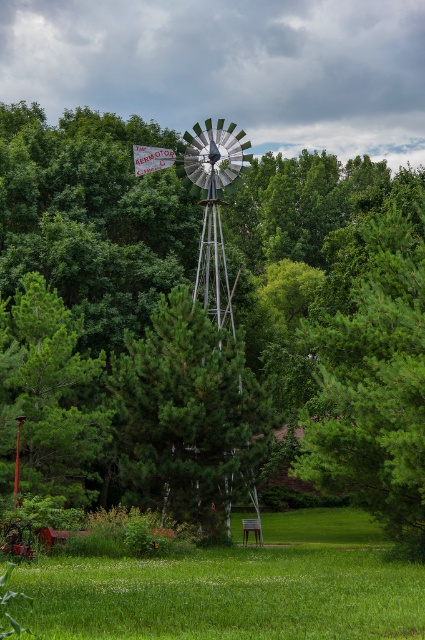
You are planning to plant a new tree in the garden. You have two options from the image, the green leafy tree at center and the green textured pine tree at center. Which one requires more space to grow properly?

The green leafy tree at center requires more space to grow properly because it is bigger than the green textured pine tree at center.

You are standing in the rural landscape and want to take a photo of both the green grass at lower center and the green matte tree at center. Which object should you focus on first to ensure both are in clear view?

You should focus on the green grass at lower center first because it is closer to the viewer than the green matte tree at center, so adjusting focus from near to far will help both be in clear view.

You are standing at the wooden bench near the center right of the image. You want to walk to the point marked as point (405, 362) and then to point (204, 445). Which point will require you to walk further away from the camera?

Point (204, 445) is further away from the camera than point (405, 362), so you will need to walk further away from the camera to reach point (204, 445).